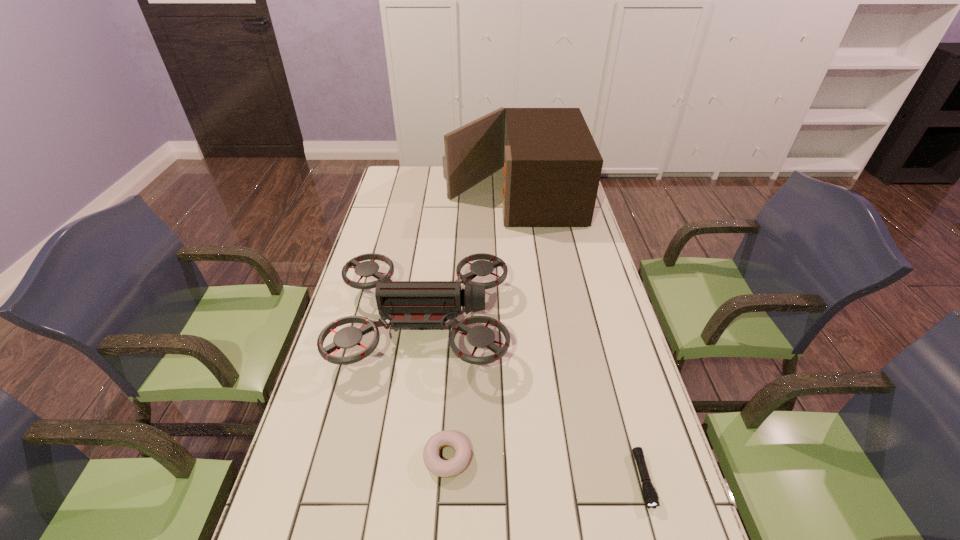
Identify the location of object that is at the left edge. This screenshot has height=540, width=960. (406, 304).

Identify the location of microwave oven that is at the right edge. The width and height of the screenshot is (960, 540). (552, 166).

Identify the location of flashlight at the right edge. The width and height of the screenshot is (960, 540). (650, 496).

This screenshot has width=960, height=540. Identify the location of object at the far right corner. (552, 166).

What are the coordinates of `vacant area at the far edge of the desktop` in the screenshot? It's located at (436, 169).

I want to click on vacant area at the left edge of the desktop, so click(346, 354).

Image resolution: width=960 pixels, height=540 pixels. In order to click on vacant space at the right edge in this screenshot , I will do `click(611, 344)`.

In the image, there is a desktop. Where is `vacant space at the far left corner`? vacant space at the far left corner is located at coordinates (388, 179).

Where is `free space between the doughnut and the flashlight`? free space between the doughnut and the flashlight is located at coordinates pyautogui.click(x=545, y=468).

This screenshot has height=540, width=960. Find the location of `free space between the flashlight and the third tallest object`. free space between the flashlight and the third tallest object is located at coordinates (545, 468).